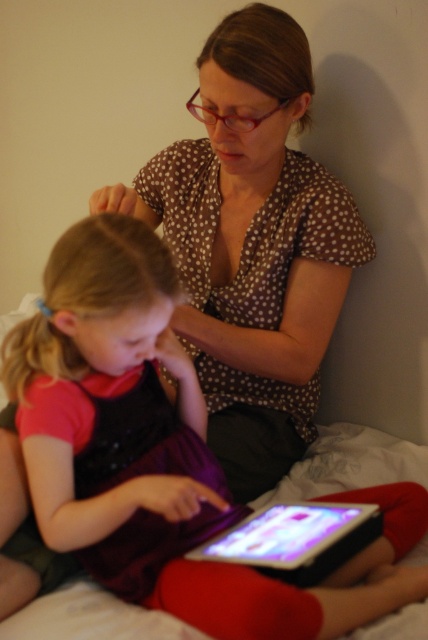
Based on the photo, does matte purple dress at center have a smaller size compared to brown dotted blouse at upper center?

Correct, matte purple dress at center occupies less space than brown dotted blouse at upper center.

Between point (131, 529) and point (350, 228), which one is positioned in front?

Point (131, 529) is more forward.

Locate an element on the screen. The width and height of the screenshot is (428, 640). matte purple dress at center is located at coordinates (160, 452).

Where is `matte purple dress at center`? The width and height of the screenshot is (428, 640). matte purple dress at center is located at coordinates (160, 452).

Does point (121, 557) lie in front of point (279, 538)?

No, (121, 557) is further to viewer.

Can you confirm if matte purple dress at center is bigger than black glossy tablet at lower center?

Correct, matte purple dress at center is larger in size than black glossy tablet at lower center.

Find the location of a particular element. The height and width of the screenshot is (640, 428). matte purple dress at center is located at coordinates (160, 452).

Between brown dotted blouse at upper center and black glossy tablet at lower center, which one is positioned lower?

black glossy tablet at lower center is below.

Can you confirm if brown dotted blouse at upper center is wider than black glossy tablet at lower center?

Yes, brown dotted blouse at upper center is wider than black glossy tablet at lower center.

Where is `brown dotted blouse at upper center`? brown dotted blouse at upper center is located at coordinates (252, 244).

Where is `brown dotted blouse at upper center`? The width and height of the screenshot is (428, 640). brown dotted blouse at upper center is located at coordinates (252, 244).